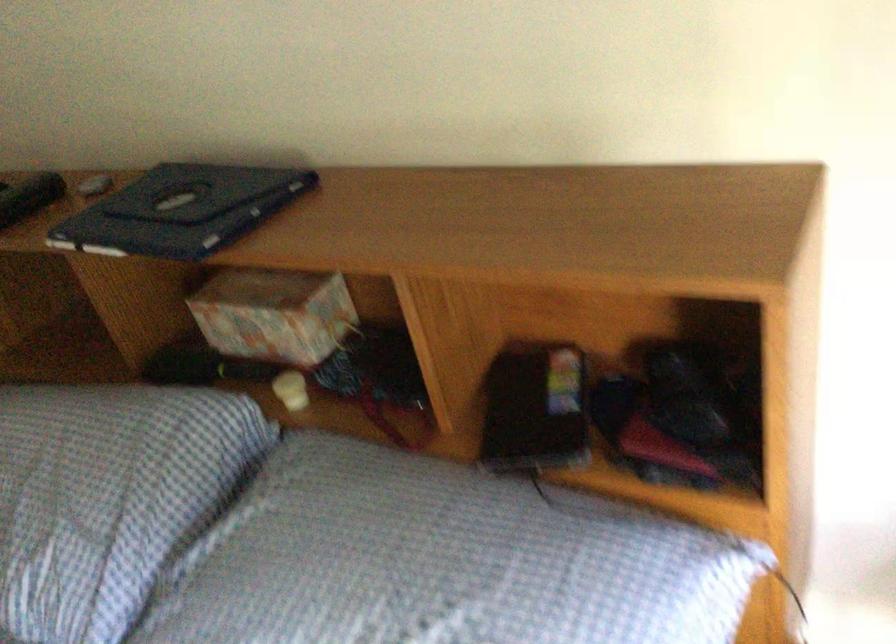
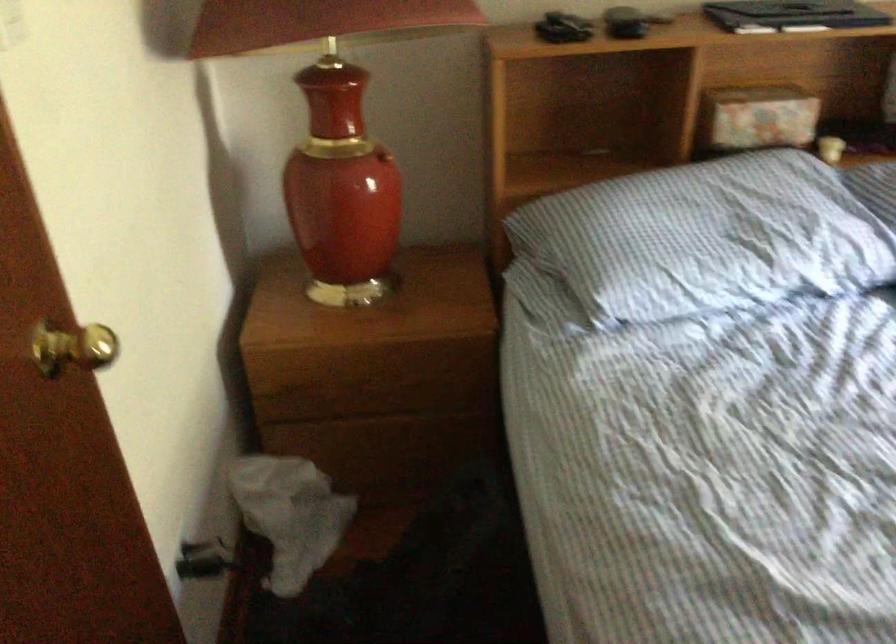
The point at [225,326] is marked in the first image. Where is the corresponding point in the second image?

(757, 118)